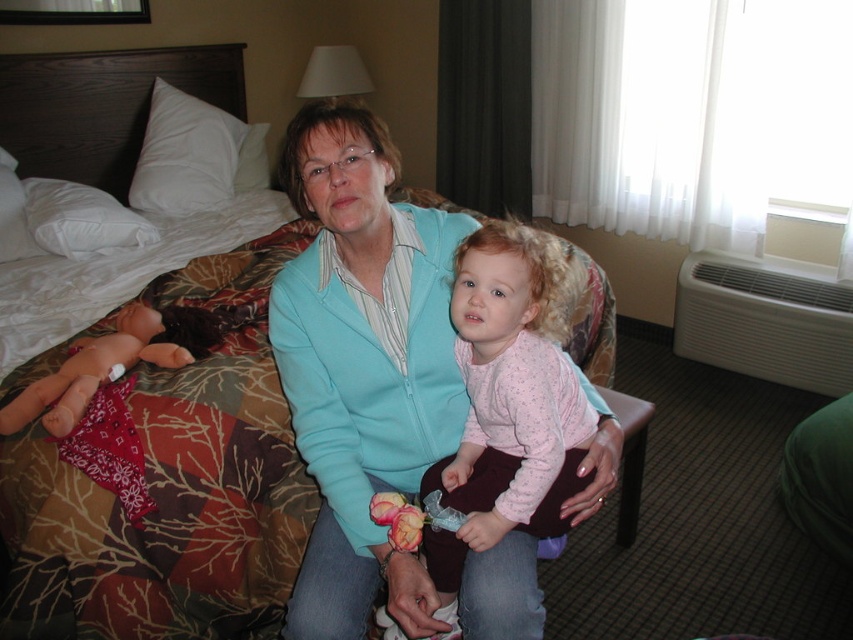
Question: Is patchwork fabric bed at center further to camera compared to pink fabric doll at left?

Choices:
 (A) no
 (B) yes

Answer: (A)

Question: Is the position of matte teal sweater at center less distant than that of pink fabric doll at left?

Choices:
 (A) no
 (B) yes

Answer: (B)

Question: Which is farther from the pink fabric doll at left?

Choices:
 (A) pink fabric at center
 (B) matte teal sweater at center
 (C) patchwork fabric bed at center

Answer: (A)

Question: Estimate the real-world distances between objects in this image. Which object is closer to the patchwork fabric bed at center?

Choices:
 (A) matte teal sweater at center
 (B) pink fabric doll at left
 (C) pink fabric at center

Answer: (B)

Question: Is pink fabric at center to the right of pink fabric doll at left from the viewer's perspective?

Choices:
 (A) yes
 (B) no

Answer: (A)

Question: Considering the real-world distances, which object is farthest from the patchwork fabric bed at center?

Choices:
 (A) pink fabric doll at left
 (B) pink fabric at center
 (C) matte teal sweater at center

Answer: (B)